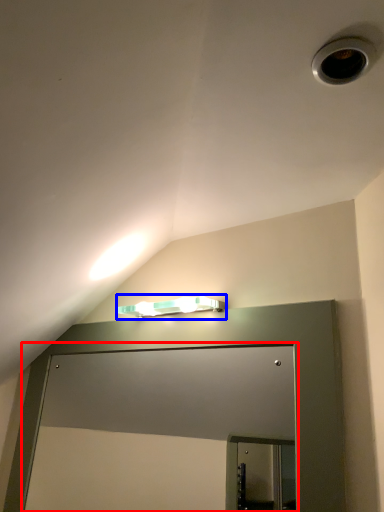
Question: Which object is closer to the camera taking this photo, glass door (highlighted by a red box) or lamp (highlighted by a blue box)?

Choices:
 (A) glass door
 (B) lamp

Answer: (A)